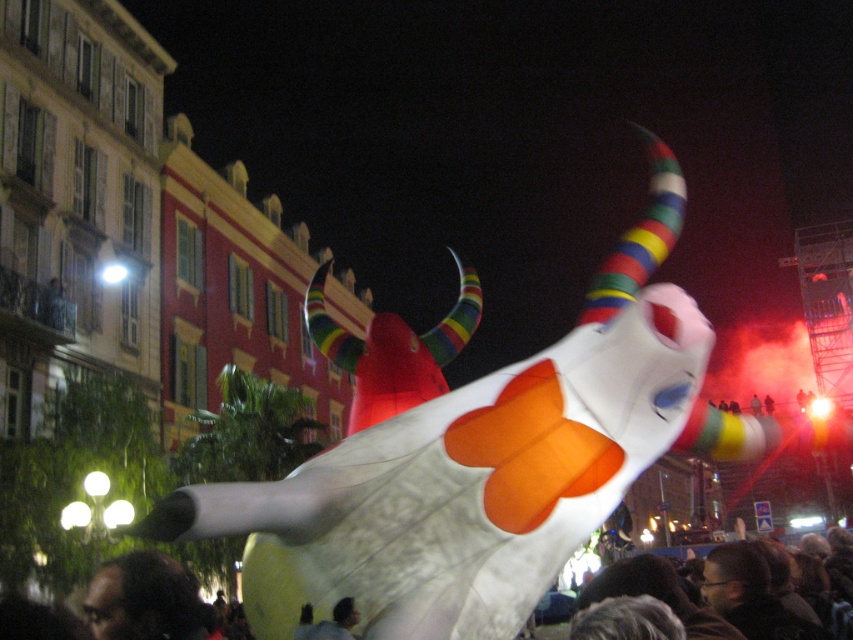
You are a photographer standing at the origin point of the image coordinate system. You want to capture a photo of the white fabric bull at center. What are the coordinates where you should aim your camera?

The coordinates to aim your camera are at point (471,465).

Consider the image. You are a photographer standing at the dark hair at lower left position. You want to take a photo of the white fabric bull at center. Can you fit both the bull and the surrounding buildings in your shot without moving? Explain your reasoning.

The distance between the white fabric bull at center and dark hair at lower left is 35.03 feet. Since the photographer is at the dark hair position, they are 35.03 feet away from the bull. The surrounding buildings are in the background behind the bull, so they should already be within the frame if the bull is centered. Therefore, the photographer can likely capture both the bull and the buildings without moving.